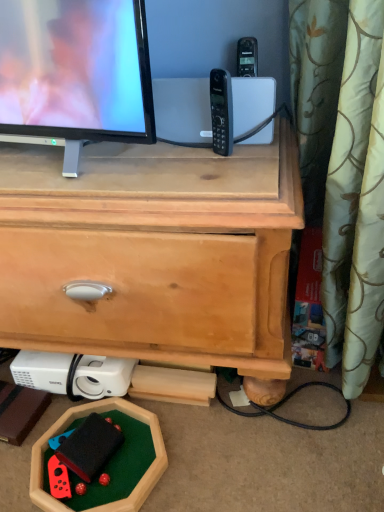
Locate an element on the screen. This screenshot has width=384, height=512. free location to the right of black plastic phone at center is located at coordinates (261, 154).